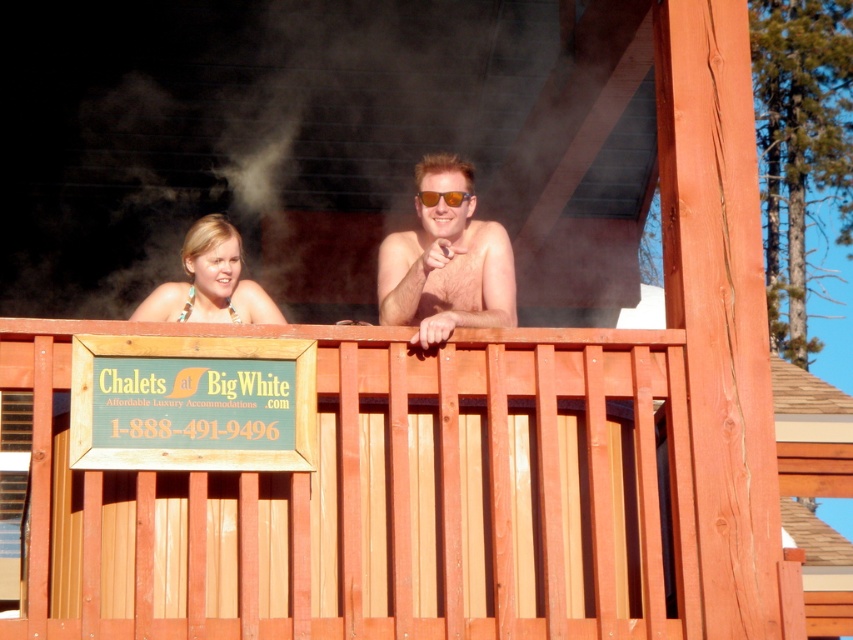
You are standing on the deck and want to place a 15 feet long ladder between the wooden slats at center and the matte gold sunglasses at upper center. Can the ladder fit in the space between them?

The distance between the wooden slats at center and the matte gold sunglasses at upper center is 17.08 feet, so the 15 feet long ladder can fit in the space between them since it is shorter than the available distance.

You are designing a new sign for the deck and want to place a decorative item next to the wooden slats at center and the matte gold sunglasses at upper center. Which object should you place the item closer to if you want it to appear proportionally balanced with the sizes of the objects?

You should place the decorative item closer to the wooden slats at center because it is larger than the matte gold sunglasses at upper center, so balancing with a larger object requires more space.